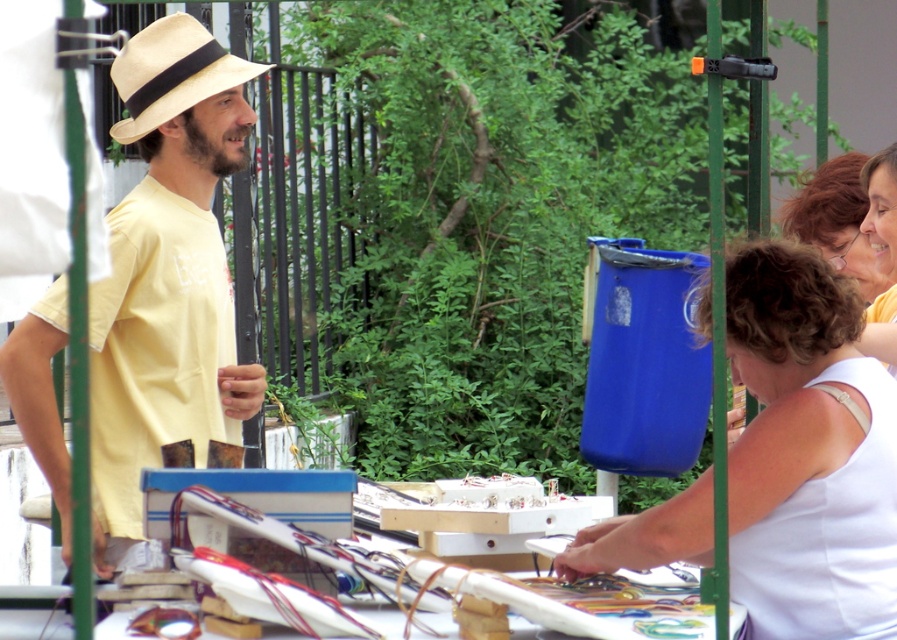
Question: Is matte yellow t-shirt at left smaller than white matte tank top at right?

Choices:
 (A) yes
 (B) no

Answer: (B)

Question: Does matte yellow t-shirt at left have a smaller size compared to white matte tank top at right?

Choices:
 (A) no
 (B) yes

Answer: (A)

Question: Can you confirm if matte yellow t-shirt at left is wider than white matte tank top at right?

Choices:
 (A) no
 (B) yes

Answer: (A)

Question: Which is farther from the natural straw hat at center?

Choices:
 (A) matte yellow t-shirt at left
 (B) white matte tank top at right

Answer: (B)

Question: Estimate the real-world distances between objects in this image. Which object is closer to the matte yellow t-shirt at left?

Choices:
 (A) natural straw hat at center
 (B) white matte tank top at right

Answer: (A)

Question: Which point appears closest to the camera in this image?

Choices:
 (A) (189, 209)
 (B) (197, 38)

Answer: (A)